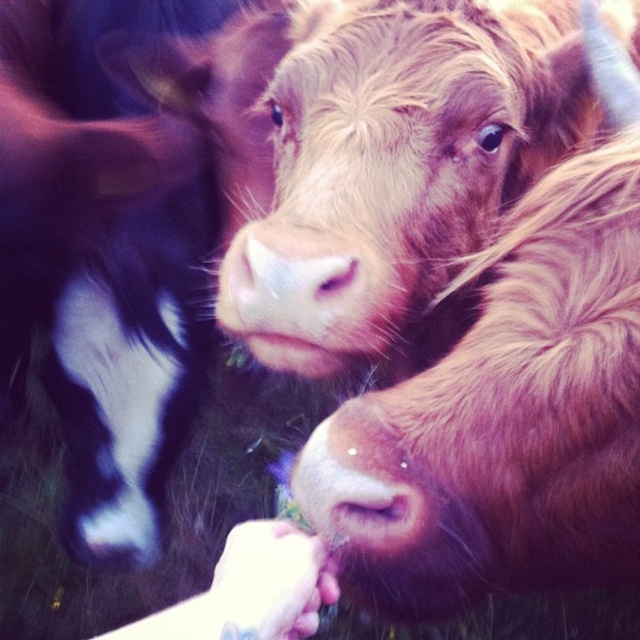
You are a farmer checking the health of your cows. You notice the brown furry cow at center and the pink soft fur nose at center. Which one has a larger size?

The brown furry cow at center is bigger than the pink soft fur nose at center.

You are a photographer trying to capture a close shot of the pink soft fur nose at center and the black and white fur at left. Since you want both subjects in focus, which one should you focus on first to ensure the other is also in sharp detail?

The pink soft fur nose at center is behind the black and white fur at left, so you should focus on the black and white fur at left first to ensure both are in sharp detail.

You are a photographer trying to capture a close shot of the cows. You notice two points marked in the image. Which point is closer to your camera, point (468, 234) or point (248, 252)?

Point (248, 252) is closer to the camera because the description states that point (468, 234) is further away.